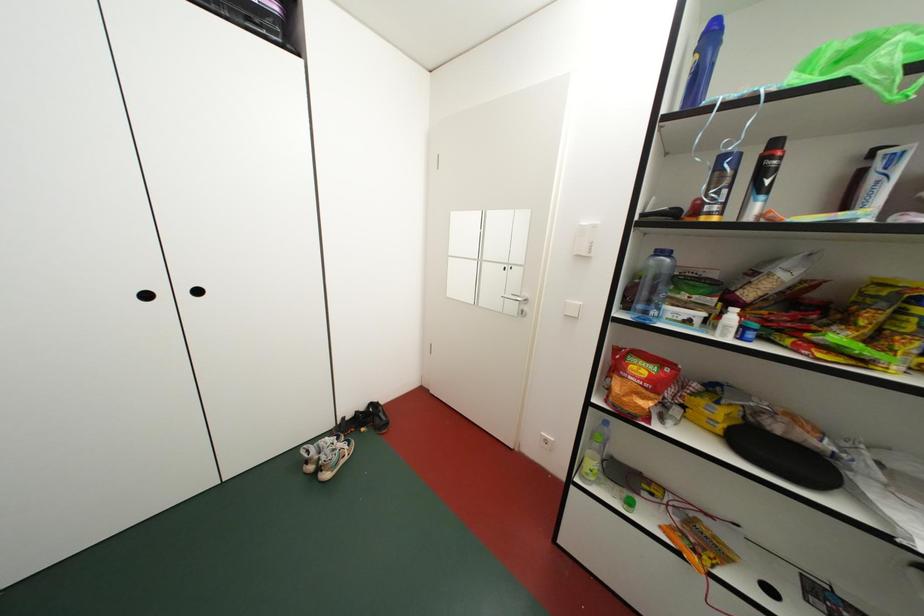
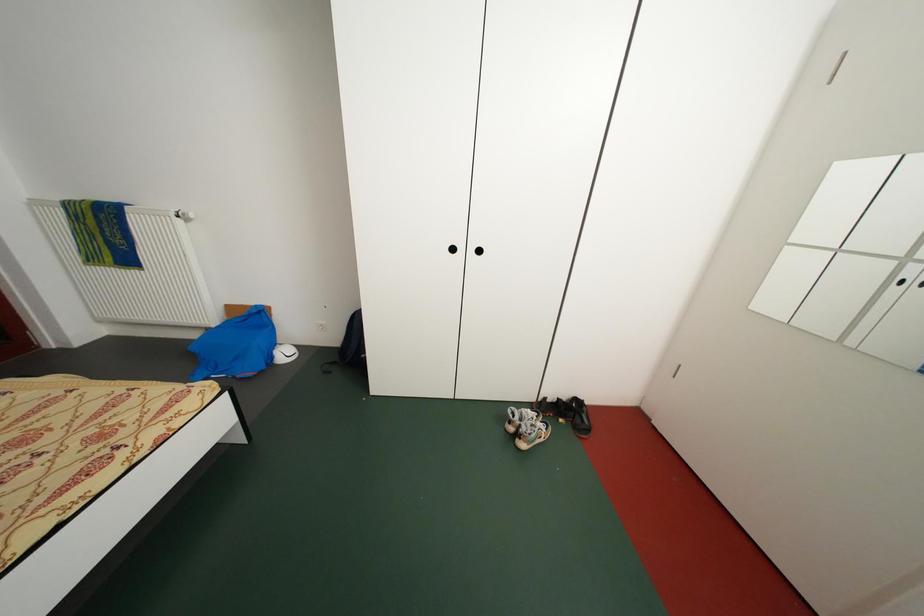
Question: Based on the continuous images, in which direction is the camera rotating? Reply with the corresponding letter.

Choices:
 (A) Left
 (B) Right
 (C) Up
 (D) Down

Answer: (A)